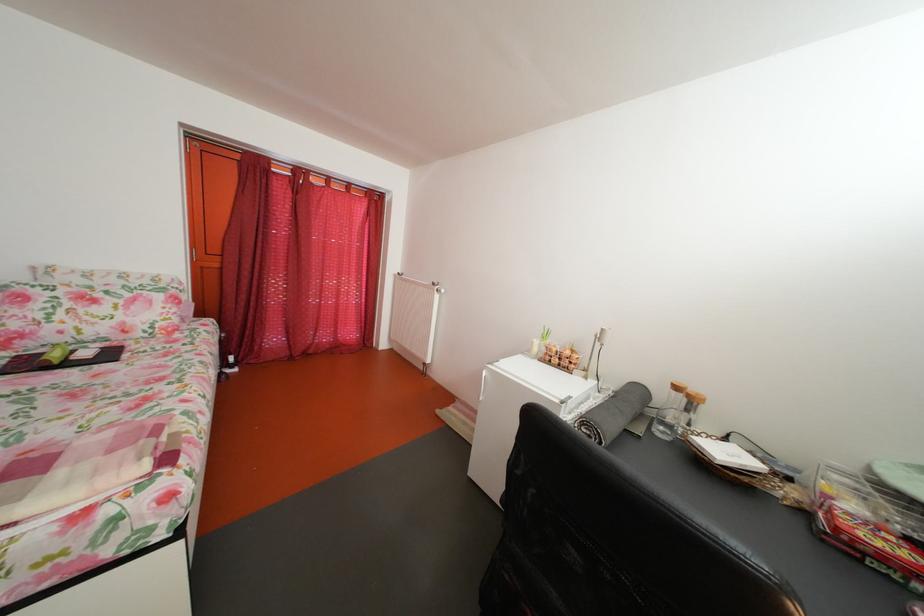
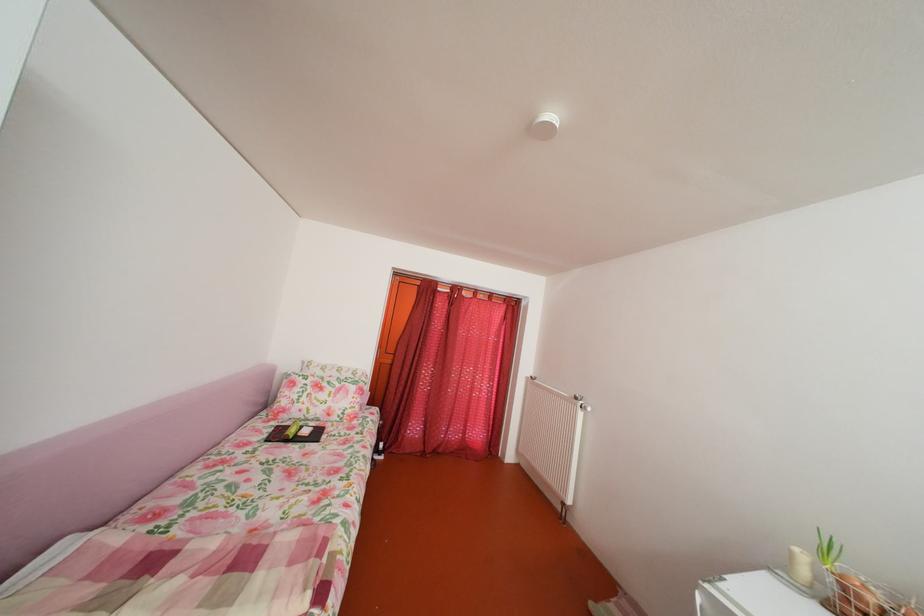
Locate, in the second image, the point that corresponds to point 543,350 in the first image.

(803, 561)